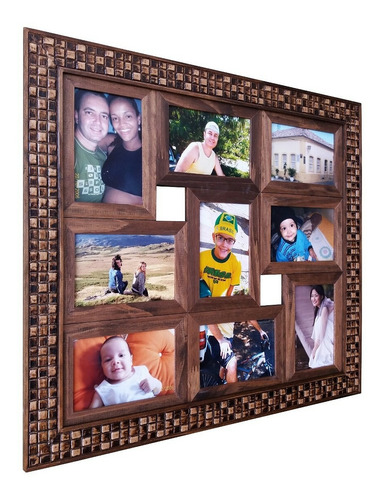
This screenshot has width=384, height=500. In order to click on pictures in this screenshot , I will do `click(308, 158)`, `click(307, 224)`, `click(307, 319)`, `click(241, 345)`, `click(234, 280)`, `click(217, 137)`, `click(104, 158)`, `click(117, 260)`, `click(122, 356)`.